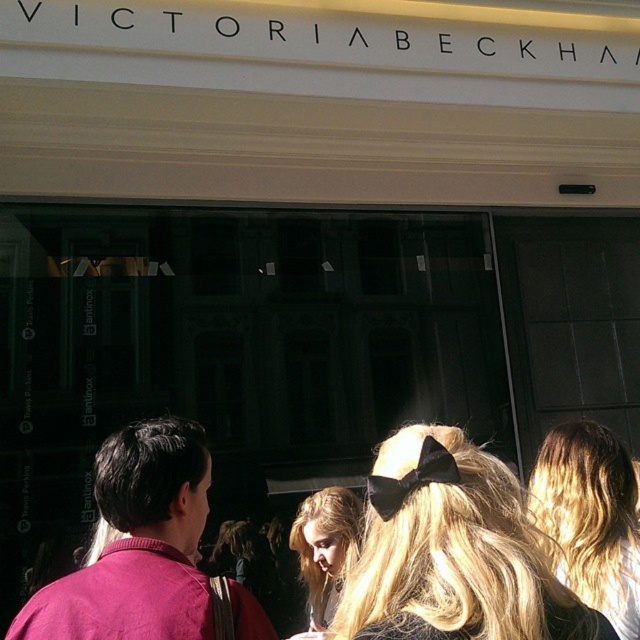
Question: Which object is closer to the camera taking this photo?

Choices:
 (A) black velvet bow at upper center
 (B) matte pink shirt at center

Answer: (A)

Question: Is matte pink shirt at center in front of black velvet bow at upper center?

Choices:
 (A) no
 (B) yes

Answer: (A)

Question: Which object appears closest to the camera in this image?

Choices:
 (A) matte pink shirt at center
 (B) black velvet bow at upper center

Answer: (B)

Question: Which point is closer to the camera?

Choices:
 (A) (38, 609)
 (B) (428, 440)

Answer: (B)

Question: Does matte pink shirt at center appear under black velvet bow at upper center?

Choices:
 (A) yes
 (B) no

Answer: (A)

Question: Does matte pink shirt at center appear under black velvet bow at upper center?

Choices:
 (A) no
 (B) yes

Answer: (B)